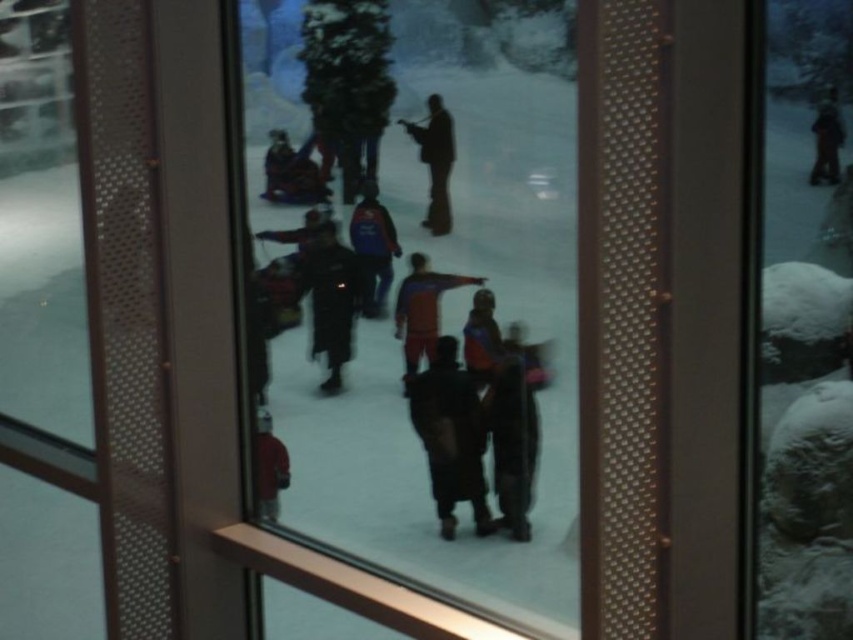
Question: Does velvet blue jacket at center appear on the right side of matte red jacket at lower left?

Choices:
 (A) yes
 (B) no

Answer: (A)

Question: Which object is farther from the camera taking this photo?

Choices:
 (A) transparent glass at center
 (B) dark brown jacket at center
 (C) matte blue jacket at center

Answer: (B)

Question: Does matte blue jacket at center appear on the right side of dark blue jacket at upper right?

Choices:
 (A) no
 (B) yes

Answer: (A)

Question: Which of the following is the farthest from the observer?

Choices:
 (A) (811, 182)
 (B) (495, 390)

Answer: (B)

Question: Which point appears farthest from the camera in this image?

Choices:
 (A) (479, 292)
 (B) (447, 225)
 (C) (486, 408)

Answer: (B)

Question: Is dark blue jacket at center further to camera compared to velvet blue jacket at center?

Choices:
 (A) no
 (B) yes

Answer: (A)